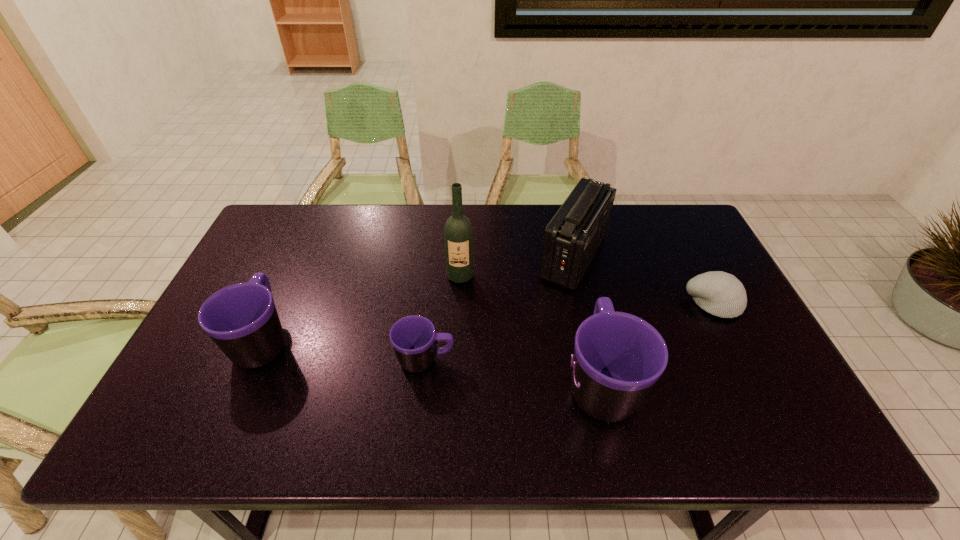
You are a GUI agent. You are given a task and a screenshot of the screen. Output one action in this format:
    pyautogui.click(x=<x>, y=<y>)
    Task: Click on the object that is at the left edge
    
    Given the screenshot: What is the action you would take?
    pyautogui.click(x=242, y=320)

I want to click on object that is at the right edge, so click(x=721, y=294).

At what (x,y) coordinates should I click in order to perform the action: click on object that is at the near left corner. Please return your answer as a coordinate pair (x, y). The height and width of the screenshot is (540, 960). Looking at the image, I should click on (242, 320).

Identify the location of free space at the far edge. Image resolution: width=960 pixels, height=540 pixels. (529, 242).

Find the location of a particular element. The width and height of the screenshot is (960, 540). free location at the near edge of the desktop is located at coordinates (418, 399).

Image resolution: width=960 pixels, height=540 pixels. What are the coordinates of `vacant region at the right edge` in the screenshot? It's located at (721, 355).

Locate an element on the screen. free space at the far left corner is located at coordinates (302, 245).

Identify the location of free region at the far right corner. (686, 232).

Where is `vacant space at the near right corner of the desktop`? Image resolution: width=960 pixels, height=540 pixels. vacant space at the near right corner of the desktop is located at coordinates (740, 390).

In order to click on vacant space that is in between the wine bottle and the radio receiver in this screenshot , I will do `click(517, 267)`.